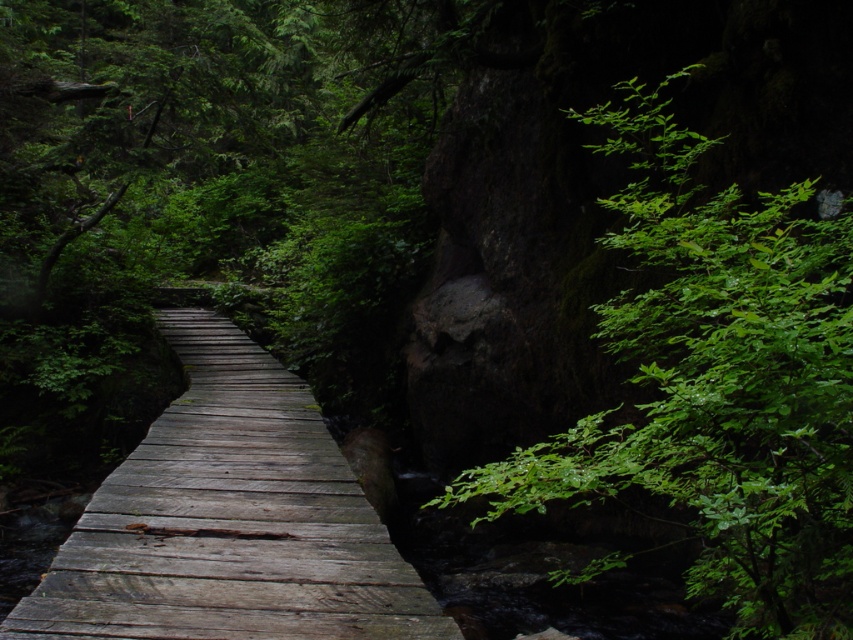
Question: Can you confirm if green leafy tree at right is positioned below wooden bridge at center?

Choices:
 (A) no
 (B) yes

Answer: (A)

Question: Is green leafy tree at right positioned before wooden bridge at center?

Choices:
 (A) yes
 (B) no

Answer: (A)

Question: Which point appears farthest from the camera in this image?

Choices:
 (A) (625, 438)
 (B) (328, 584)

Answer: (B)

Question: Which object is farther from the camera taking this photo?

Choices:
 (A) green leafy tree at right
 (B) wooden bridge at center

Answer: (B)

Question: From the image, what is the correct spatial relationship of green leafy tree at right in relation to wooden bridge at center?

Choices:
 (A) left
 (B) right

Answer: (B)